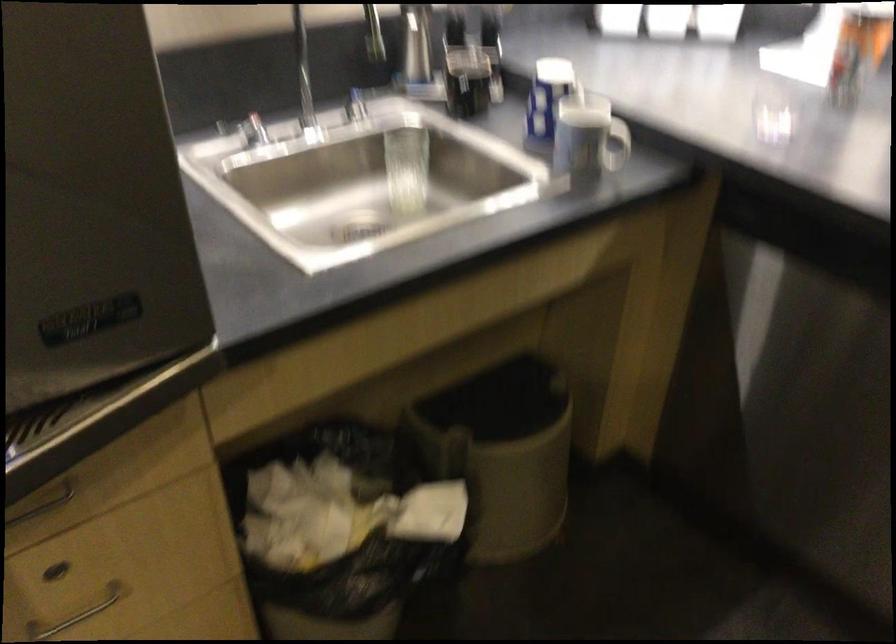
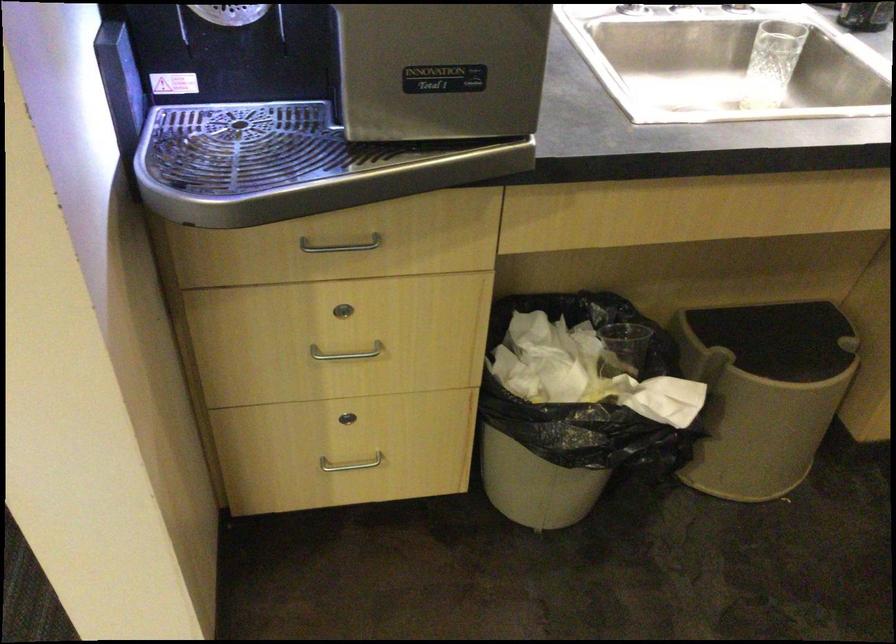
Locate, in the second image, the point that corresponds to pixel 507 406 in the first image.

(780, 339)